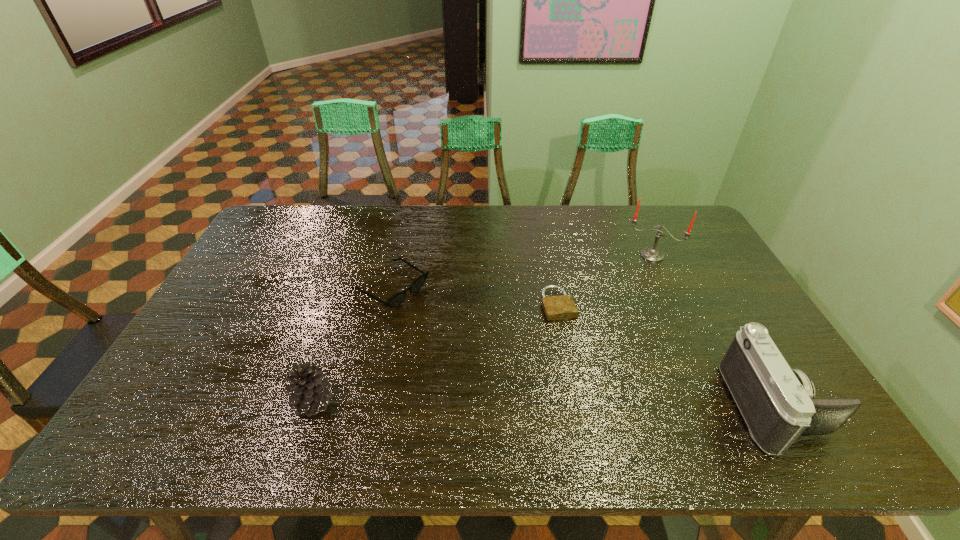
Identify the location of free space that satisfies the following two spatial constraints: 1. on the front side of the sunglasses; 2. on the left side of the shortest object. (388, 305).